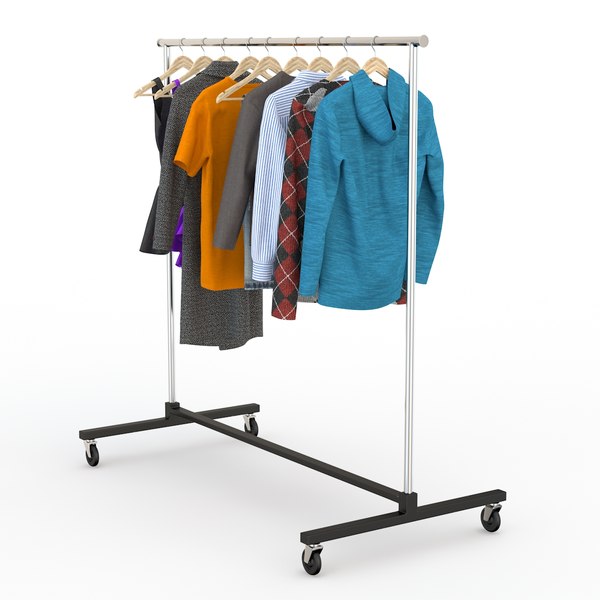
The height and width of the screenshot is (600, 600). Find the location of `clothing on hanger`. clothing on hanger is located at coordinates (377, 177), (295, 177), (272, 180), (248, 175), (220, 150), (177, 116), (159, 112), (181, 226).